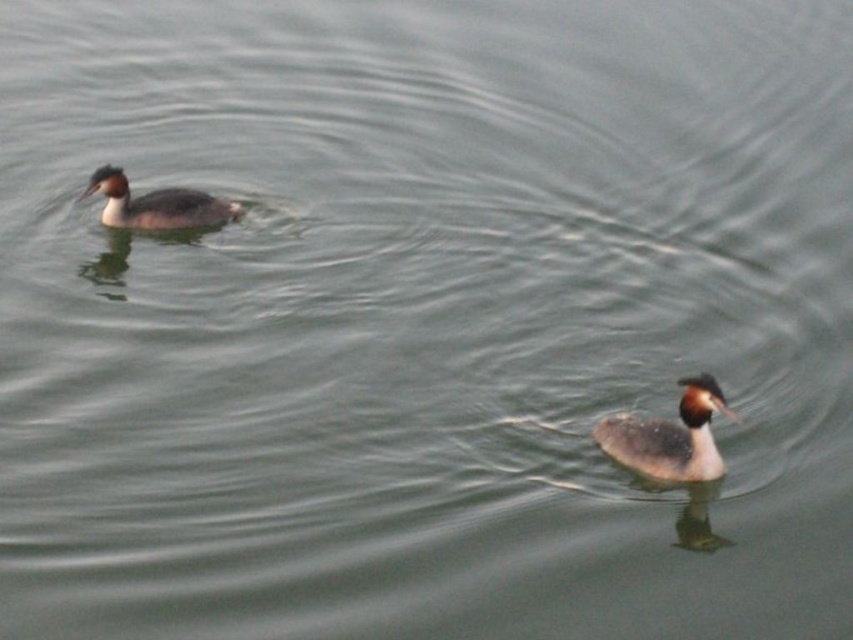
You are a birdwatcher trying to capture both the gray speckled duck at lower right and the gray matte duck at upper left in a single photo. Given that your camera has a maximum focus range of 20 feet, will you be able to include both ducks in the frame?

The distance between the gray speckled duck at lower right and the gray matte duck at upper left is 18.91 feet, which is within the camera maximum focus range of 20 feet. Therefore, both ducks can be captured in the same frame.

You are a photographer aiming to capture a close shot of the Great Crested Grebes in the scene. You are currently positioned at the camera location. The point you need to focus on is point (670, 440). Given that the distance between the camera and this point is 7.59 meters, will you need to adjust your zoom to get a closer view of the birds?

The distance between the camera and point (670, 440) is 7.59 meters. To capture a close shot of the Great Crested Grebes, you would need to adjust your zoom to magnify the birds at that distance.

You are a wildlife photographer aiming to capture the silhouette of both the gray speckled duck at lower right and the gray matte duck at upper left. Which duck will appear narrower in the photo?

The gray speckled duck at lower right will appear narrower in the photo because it is thinner than the gray matte duck at upper left.